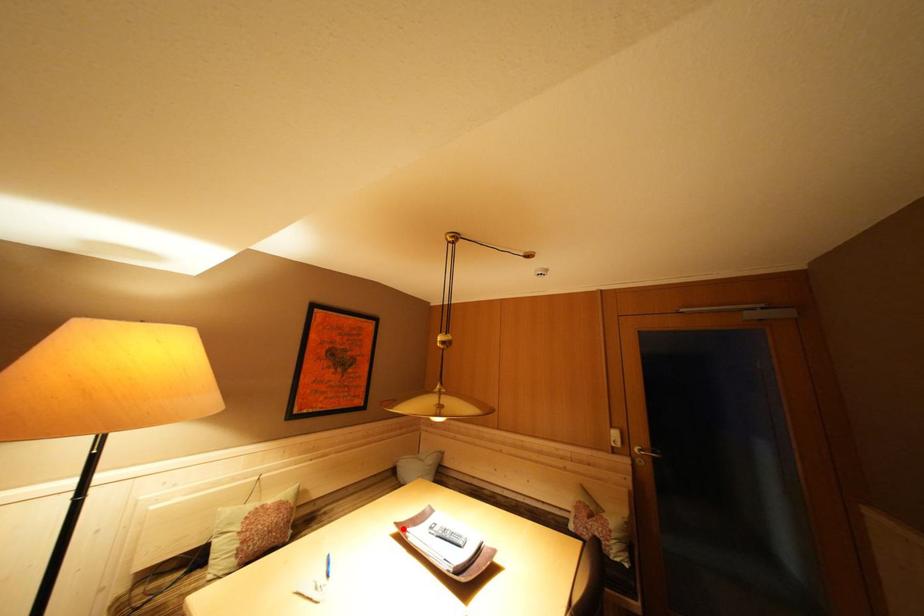
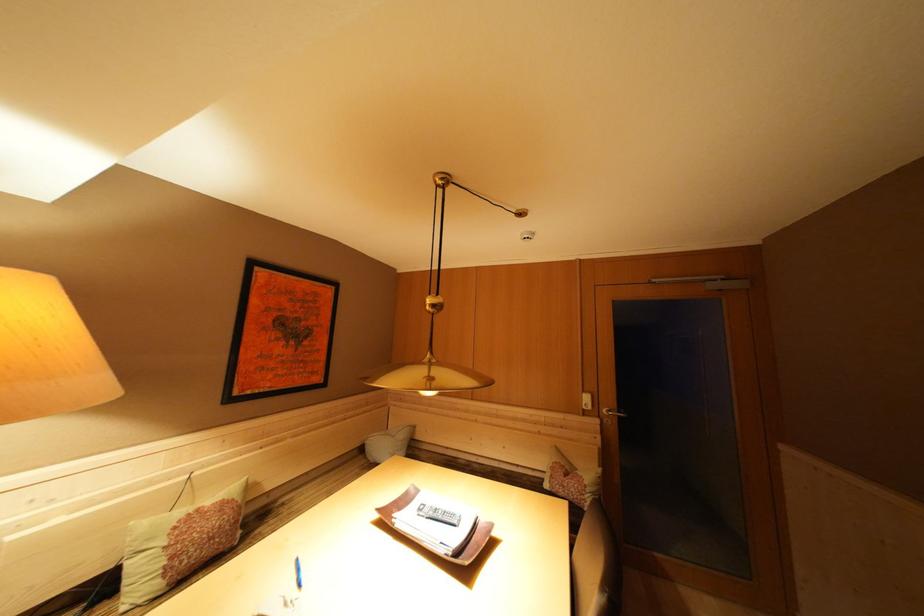
Question: I am providing you with two images of the same scene from different viewpoints. Given a red point in image1, look at the same physical point in image2. Is it:

Choices:
 (A) Closer to the viewpoint
 (B) Farther from the viewpoint

Answer: (B)